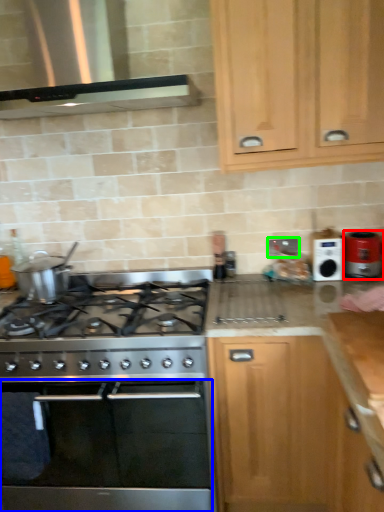
Question: Which object is the closest to the kitchen appliance (highlighted by a red box)? Choose among these: oven (highlighted by a blue box) or electric outlet (highlighted by a green box).

Choices:
 (A) oven
 (B) electric outlet

Answer: (B)